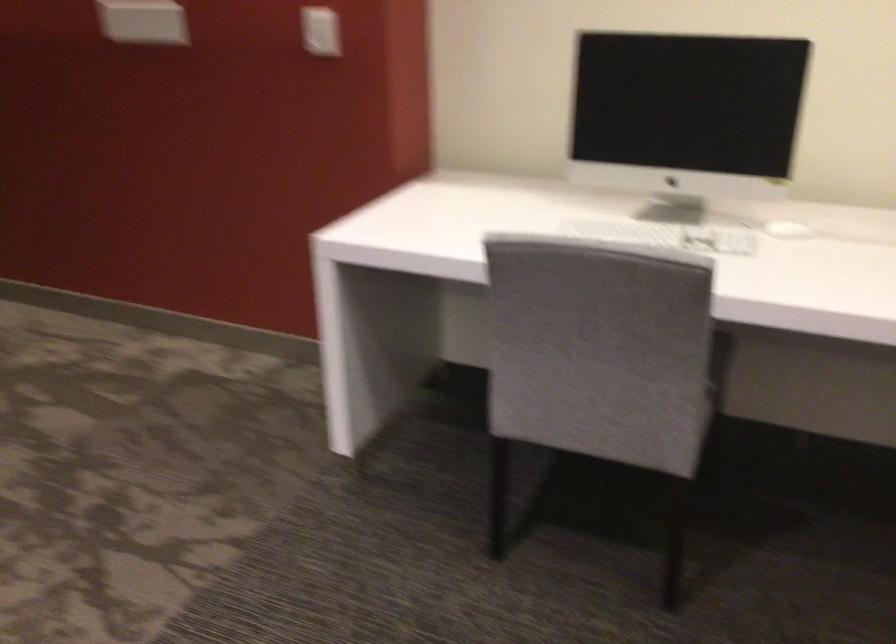
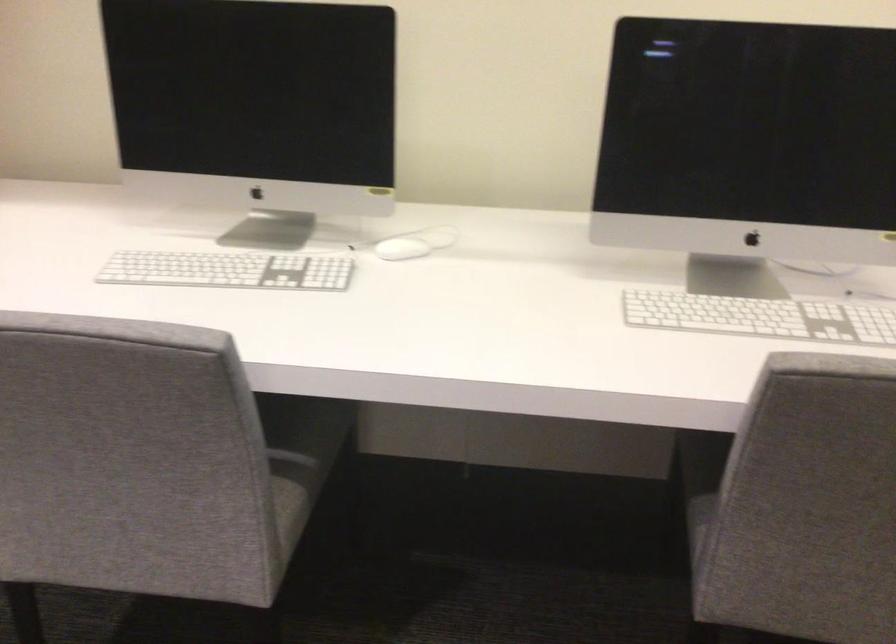
In a continuous first-person perspective shot, in which direction is the camera moving?

The cameraman moved toward right, forward.